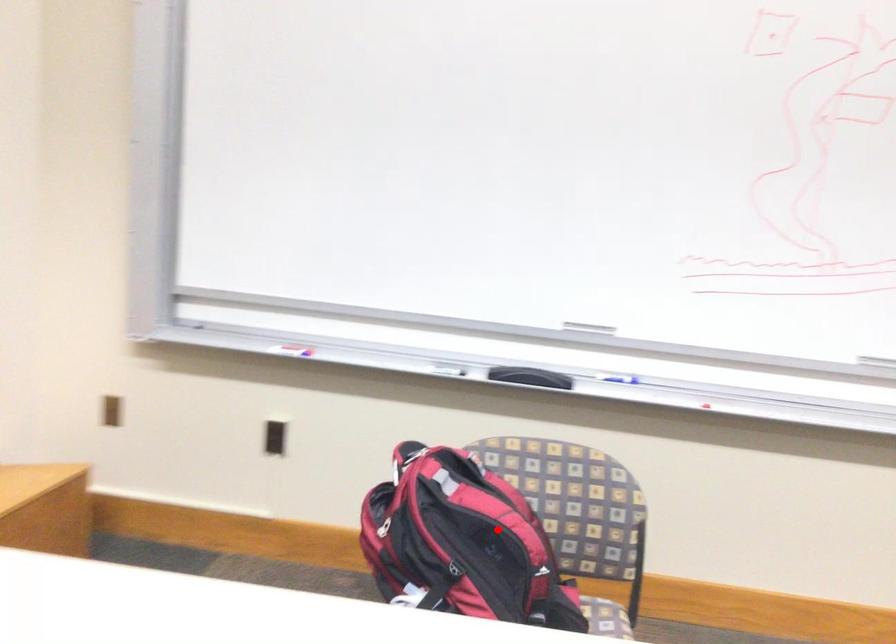
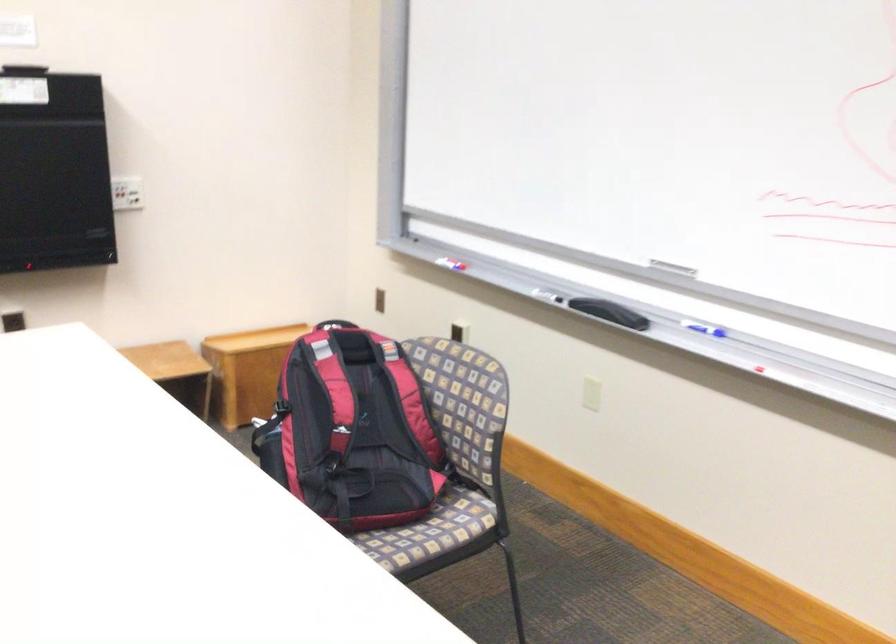
Question: I am providing you with two images of the same scene from different viewpoints. A red point is shown in image1. For the corresponding object point in image2, is it positioned nearer or farther from the camera?

Choices:
 (A) Nearer
 (B) Farther

Answer: (B)